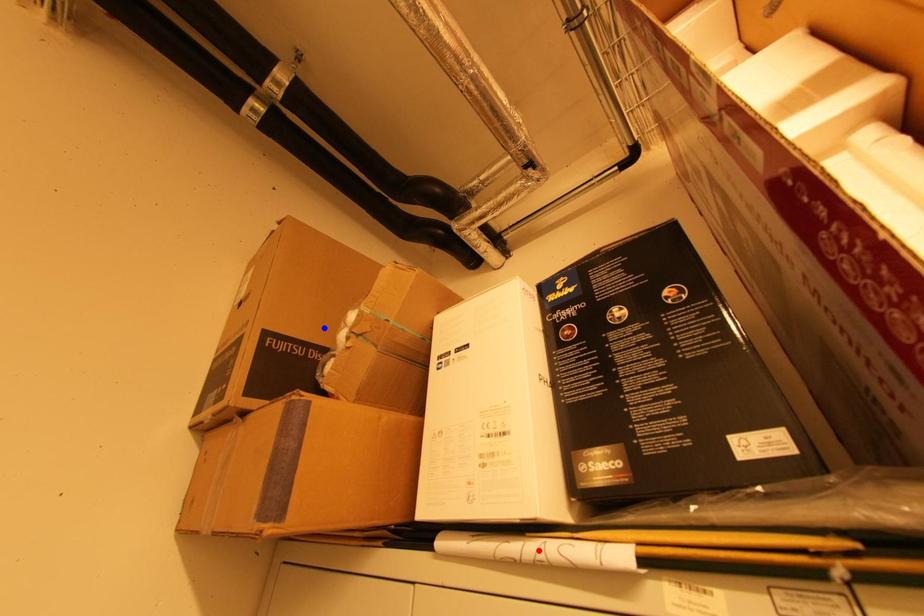
Question: Which of the two points in the image is closer to the camera?

Choices:
 (A) Blue point is closer.
 (B) Red point is closer.

Answer: (B)